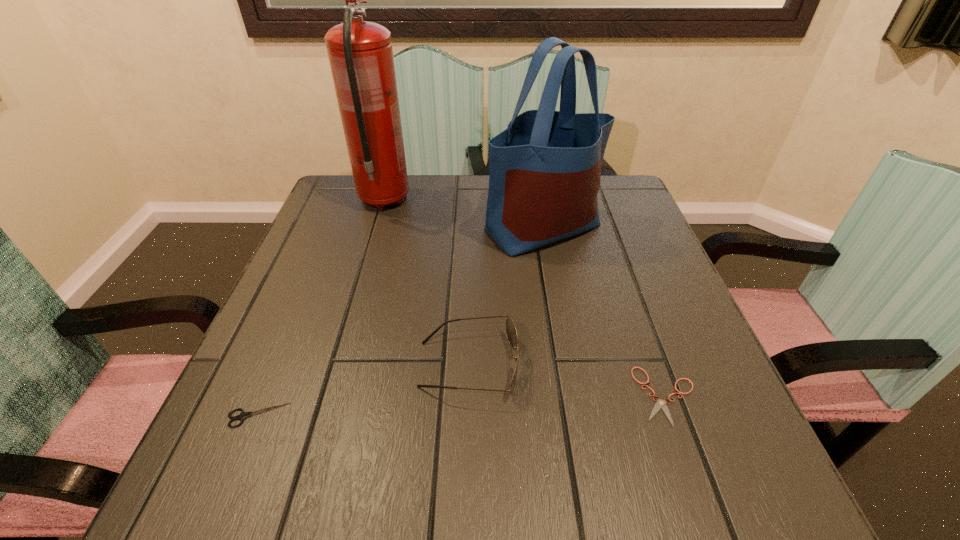
Where is `free space located 0.060m on the front of the shortest object`? The width and height of the screenshot is (960, 540). free space located 0.060m on the front of the shortest object is located at coordinates (693, 468).

You are a GUI agent. You are given a task and a screenshot of the screen. Output one action in this format:
    pyautogui.click(x=<x>, y=<y>)
    Task: Click on the fire extinguisher that is at the far edge
    
    Given the screenshot: What is the action you would take?
    pyautogui.click(x=360, y=53)

I want to click on handbag located at the far edge, so click(x=544, y=170).

The image size is (960, 540). I want to click on fire extinguisher present at the left edge, so click(360, 53).

At what (x,y) coordinates should I click in order to perform the action: click on shears located at the left edge. Please return your answer as a coordinate pair (x, y). The height and width of the screenshot is (540, 960). Looking at the image, I should click on (242, 416).

I want to click on handbag at the right edge, so click(544, 170).

Find the location of a particular element. The image size is (960, 540). shears situated at the right edge is located at coordinates (660, 403).

The height and width of the screenshot is (540, 960). I want to click on object at the far left corner, so click(x=360, y=53).

What are the coordinates of `object present at the far right corner` in the screenshot? It's located at (544, 170).

You are a GUI agent. You are given a task and a screenshot of the screen. Output one action in this format:
    pyautogui.click(x=<x>, y=<y>)
    Task: Click on the blank space at the near edge
    
    Given the screenshot: What is the action you would take?
    pyautogui.click(x=334, y=512)